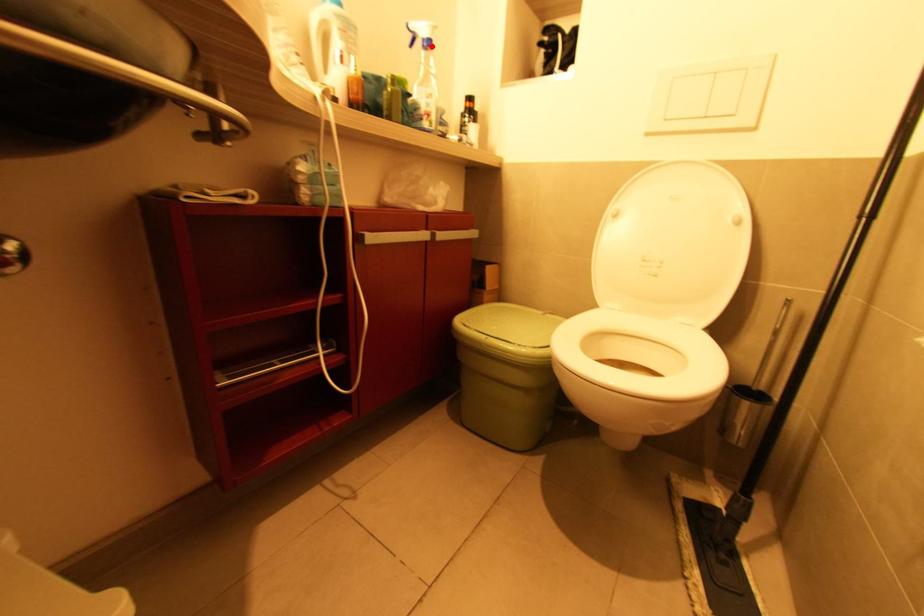
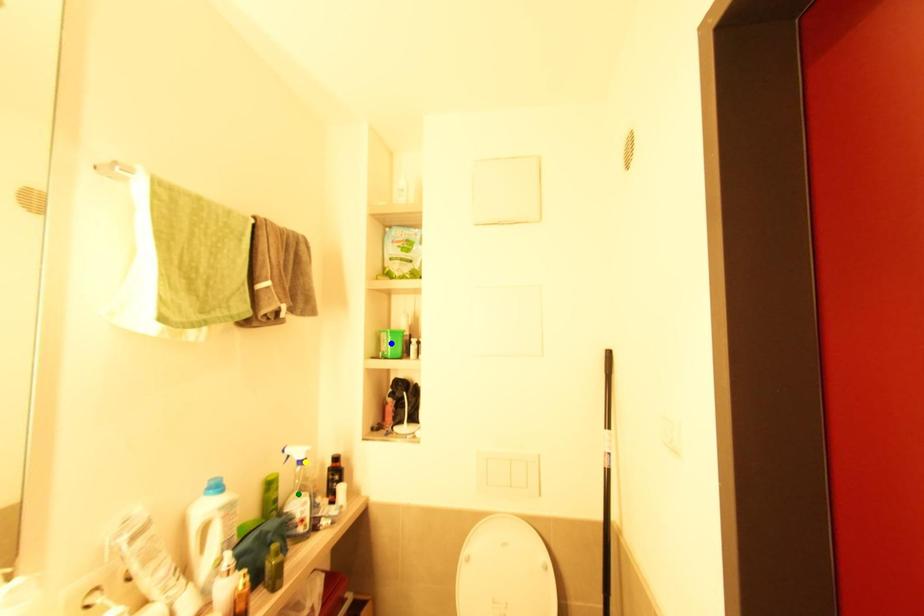
Question: I am providing you with two images of the same scene from different viewpoints. A red point is marked on the first image. You are given multiple points on the second image. In image 2, which mark is for the same physical point as the one in image 1?

Choices:
 (A) yellow point
 (B) blue point
 (C) green point

Answer: (A)